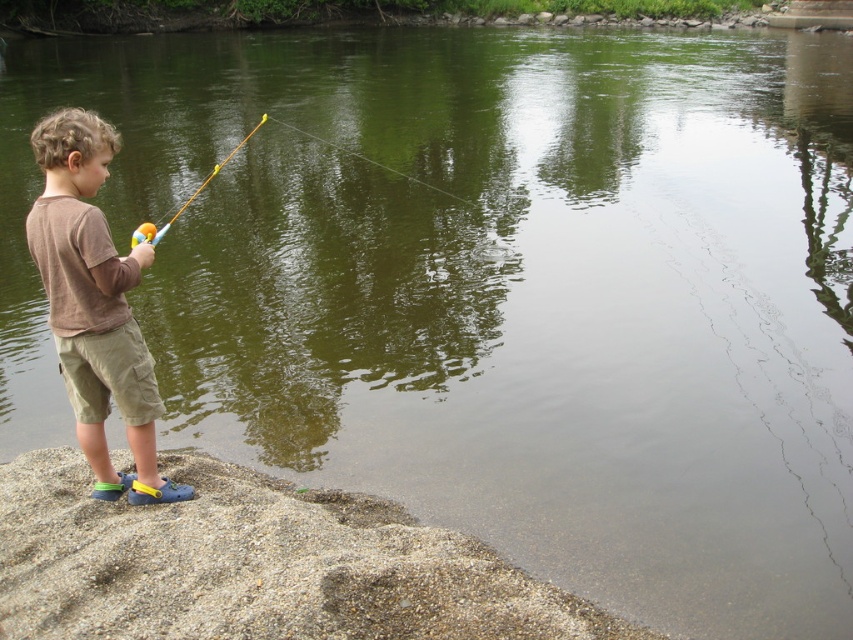
Can you confirm if brown gravel at lower left is wider than blue plastic fishing pole at left?

Yes, brown gravel at lower left is wider than blue plastic fishing pole at left.

Between point (160, 458) and point (157, 237), which one is positioned behind?

Point (160, 458)

Which is behind, point (601, 628) or point (196, 189)?

Positioned behind is point (196, 189).

Identify the location of brown gravel at lower left. The image size is (853, 640). (256, 564).

Can you confirm if blue plastic fishing pole at left is shorter than transparent plastic fishing line at center?

No, blue plastic fishing pole at left is not shorter than transparent plastic fishing line at center.

Does blue plastic fishing pole at left appear under transparent plastic fishing line at center?

Correct, blue plastic fishing pole at left is located below transparent plastic fishing line at center.

Which is behind, point (204, 180) or point (318, 141)?

The point (318, 141) is behind.

The width and height of the screenshot is (853, 640). I want to click on blue plastic fishing pole at left, so click(184, 200).

Does brown cotton shirt at left have a smaller size compared to transparent plastic fishing line at center?

Yes.

Does brown cotton shirt at left come in front of transparent plastic fishing line at center?

Yes.

Between point (97, 456) and point (460, 202), which one is positioned in front?

Point (97, 456) is in front.

Locate an element on the screen. The height and width of the screenshot is (640, 853). brown cotton shirt at left is located at coordinates (94, 304).